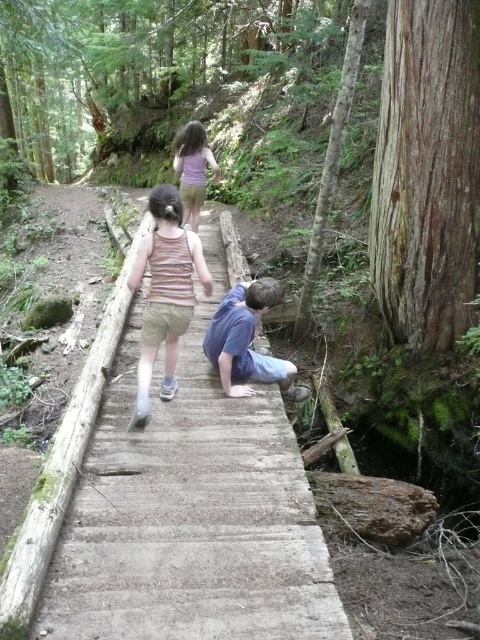
Question: Which of these objects is positioned farthest from the blue cotton shirt at center?

Choices:
 (A) striped tank top at center
 (B) wooden log bridge at center
 (C) purple matte shirt at upper center

Answer: (C)

Question: Which of the following is the closest to the observer?

Choices:
 (A) striped tank top at center
 (B) purple matte shirt at upper center
 (C) wooden log bridge at center

Answer: (C)

Question: Can you confirm if wooden log bridge at center is wider than purple matte shirt at upper center?

Choices:
 (A) no
 (B) yes

Answer: (B)

Question: Which point is farther to the camera?

Choices:
 (A) (228, 404)
 (B) (168, 224)
 (C) (217, 321)

Answer: (C)

Question: Can you confirm if striped tank top at center is positioned above purple matte shirt at upper center?

Choices:
 (A) yes
 (B) no

Answer: (B)

Question: Does wooden log bridge at center appear under purple matte shirt at upper center?

Choices:
 (A) yes
 (B) no

Answer: (A)